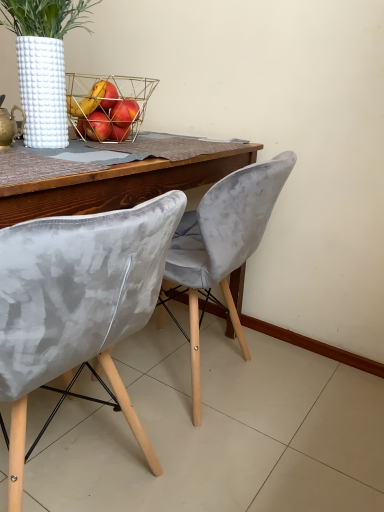
Question: In which direction should I rotate to look at velvet grey chair at center, which is the 1th chair in back-to-front order?

Choices:
 (A) right
 (B) left

Answer: (B)

Question: Considering the relative sizes of gold metallic teapot at upper left and velvet grey chair at center, the first chair from the front, in the image provided, is gold metallic teapot at upper left shorter than velvet grey chair at center, the first chair from the front,?

Choices:
 (A) no
 (B) yes

Answer: (B)

Question: Is gold metallic teapot at upper left far away from velvet grey chair at center, the first chair from the front?

Choices:
 (A) no
 (B) yes

Answer: (A)

Question: Is gold metallic teapot at upper left smaller than velvet grey chair at center, placed as the 2th chair when sorted from back to front?

Choices:
 (A) yes
 (B) no

Answer: (A)

Question: From the image's perspective, does gold metallic teapot at upper left appear higher than velvet grey chair at center, placed as the 2th chair when sorted from back to front?

Choices:
 (A) yes
 (B) no

Answer: (A)

Question: From a real-world perspective, is gold metallic teapot at upper left over velvet grey chair at center, the first chair from the front?

Choices:
 (A) no
 (B) yes

Answer: (B)

Question: Is gold metallic teapot at upper left positioned with its back to velvet grey chair at center, placed as the 2th chair when sorted from back to front?

Choices:
 (A) no
 (B) yes

Answer: (A)

Question: Does gold wire basket at center lie in front of velvet grey chair at center, which is the 1th chair in back-to-front order?

Choices:
 (A) yes
 (B) no

Answer: (B)

Question: Does gold wire basket at center appear on the left side of velvet grey chair at center, which is the 1th chair in back-to-front order?

Choices:
 (A) yes
 (B) no

Answer: (A)

Question: Does gold wire basket at center have a lesser height compared to velvet grey chair at center, marked as the 2th chair in a front-to-back arrangement?

Choices:
 (A) no
 (B) yes

Answer: (B)

Question: From the image's perspective, is gold wire basket at center on top of velvet grey chair at center, marked as the 2th chair in a front-to-back arrangement?

Choices:
 (A) yes
 (B) no

Answer: (A)

Question: Would you say gold wire basket at center contains velvet grey chair at center, which is the 1th chair in back-to-front order?

Choices:
 (A) no
 (B) yes

Answer: (A)

Question: Can you confirm if gold wire basket at center is taller than velvet grey chair at center, which is the 1th chair in back-to-front order?

Choices:
 (A) yes
 (B) no

Answer: (B)

Question: Considering the relative sizes of velvet grey chair at center, marked as the 2th chair in a front-to-back arrangement, and velvet grey chair at center, the first chair from the front, in the image provided, is velvet grey chair at center, marked as the 2th chair in a front-to-back arrangement, taller than velvet grey chair at center, the first chair from the front,?

Choices:
 (A) no
 (B) yes

Answer: (B)